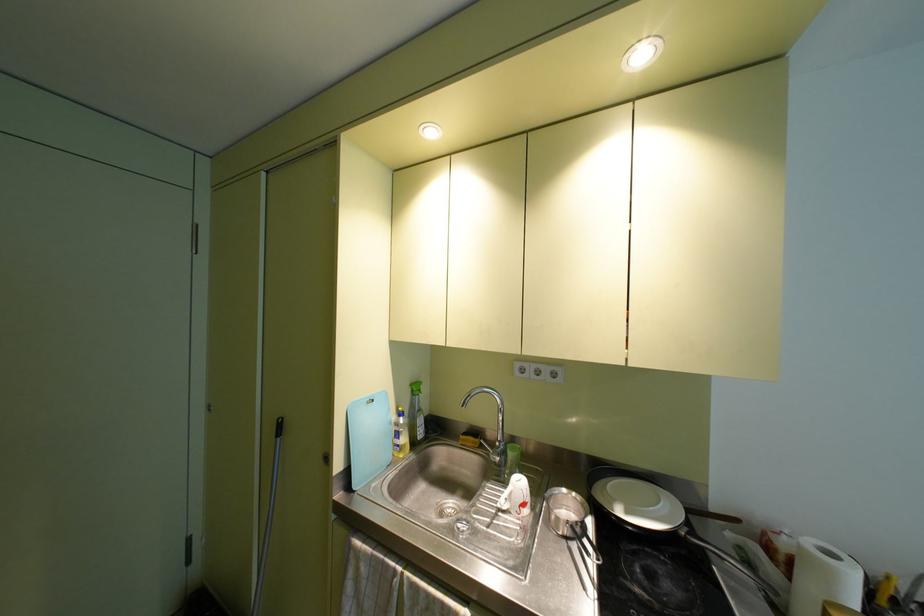
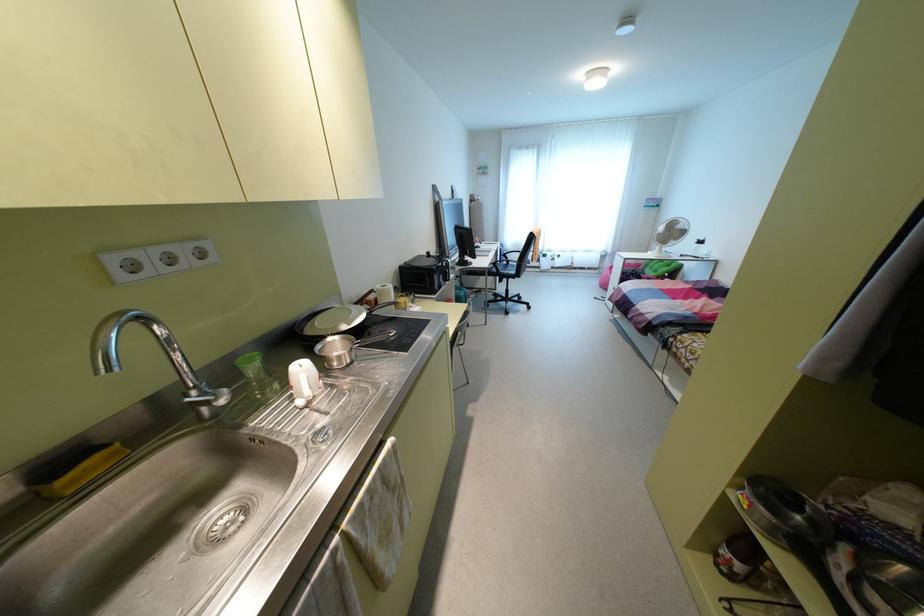
In the second image, find the point that corresponds to point 499,440 in the first image.

(195, 387)